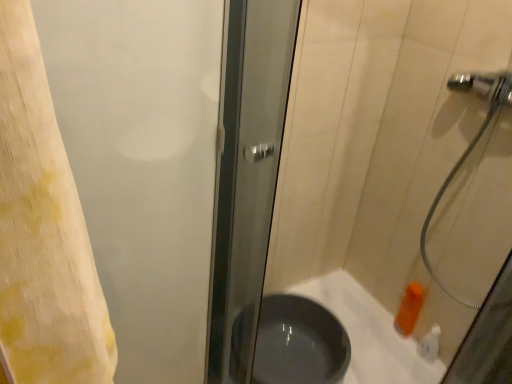
Question: Is frosted glass screen door at left outside white plastic bottle at lower right?

Choices:
 (A) yes
 (B) no

Answer: (A)

Question: From the image's perspective, would you say frosted glass screen door at left is shown under white plastic bottle at lower right?

Choices:
 (A) no
 (B) yes

Answer: (A)

Question: Does frosted glass screen door at left appear on the right side of white plastic bottle at lower right?

Choices:
 (A) yes
 (B) no

Answer: (B)

Question: Is frosted glass screen door at left taller than white plastic bottle at lower right?

Choices:
 (A) no
 (B) yes

Answer: (B)

Question: Does frosted glass screen door at left have a larger size compared to white plastic bottle at lower right?

Choices:
 (A) no
 (B) yes

Answer: (B)

Question: Considering their positions, is matte black basin at center located in front of or behind white plastic bottle at lower right?

Choices:
 (A) behind
 (B) front

Answer: (B)

Question: Is matte black basin at center taller or shorter than white plastic bottle at lower right?

Choices:
 (A) tall
 (B) short

Answer: (A)

Question: Is point pos(310,301) closer or farther from the camera than point pos(420,352)?

Choices:
 (A) closer
 (B) farther

Answer: (B)

Question: From the image's perspective, is matte black basin at center positioned above or below white plastic bottle at lower right?

Choices:
 (A) below
 (B) above

Answer: (A)

Question: From the image's perspective, is matte black basin at center above or below frosted glass screen door at left?

Choices:
 (A) above
 (B) below

Answer: (B)

Question: Is matte black basin at center in front of or behind frosted glass screen door at left in the image?

Choices:
 (A) front
 (B) behind

Answer: (B)

Question: Is matte black basin at center inside or outside of frosted glass screen door at left?

Choices:
 (A) outside
 (B) inside

Answer: (A)

Question: Looking at their shapes, would you say matte black basin at center is wider or thinner than frosted glass screen door at left?

Choices:
 (A) wide
 (B) thin

Answer: (A)

Question: Considering the positions of white plastic bottle at lower right and frosted glass screen door at left in the image, is white plastic bottle at lower right bigger or smaller than frosted glass screen door at left?

Choices:
 (A) small
 (B) big

Answer: (A)

Question: Is white plastic bottle at lower right taller or shorter than frosted glass screen door at left?

Choices:
 (A) short
 (B) tall

Answer: (A)